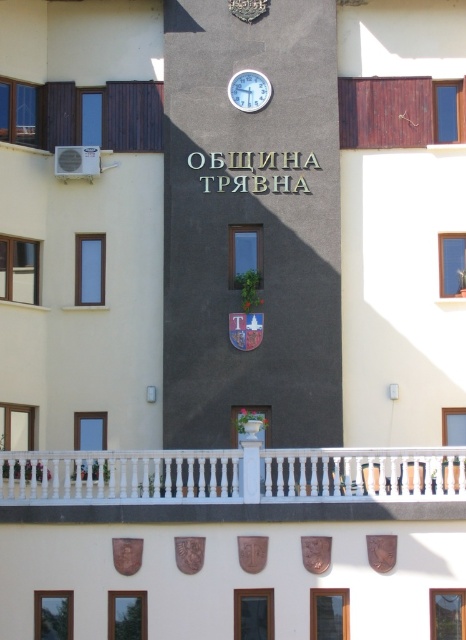
Does white wooden railing at center appear under white plastic clock at upper center?

Indeed, white wooden railing at center is positioned under white plastic clock at upper center.

Measure the distance between point (411, 481) and camera.

They are 191.10 feet apart.

In order to click on white wooden railing at center in this screenshot , I will do `click(233, 476)`.